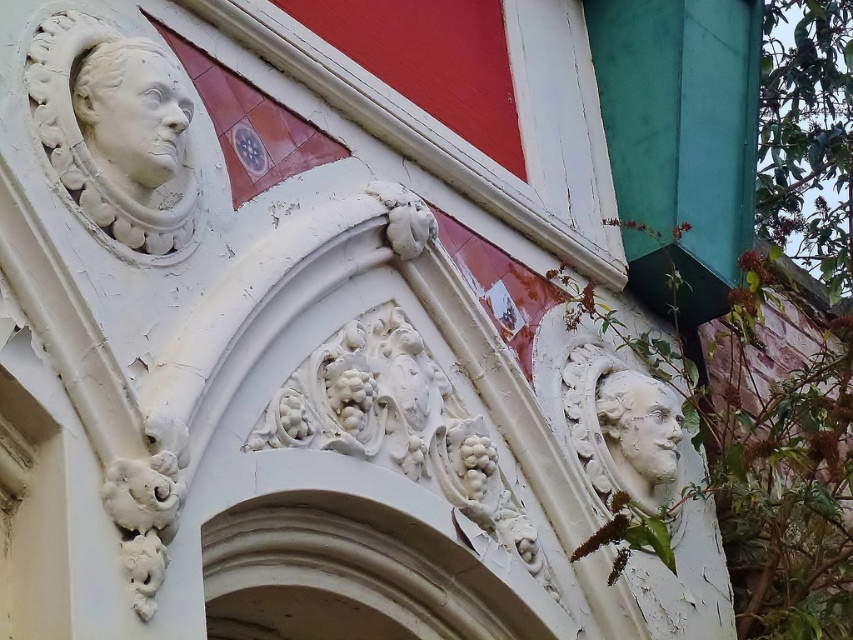
Question: Observing the image, what is the correct spatial positioning of white plaster face at upper left in reference to white stone face at lower right?

Choices:
 (A) left
 (B) right

Answer: (A)

Question: Can you confirm if white plaster face at upper left is positioned to the left of white stone face at lower right?

Choices:
 (A) yes
 (B) no

Answer: (A)

Question: Can you confirm if white plaster face at upper left is positioned above white stone face at lower right?

Choices:
 (A) no
 (B) yes

Answer: (B)

Question: Which object is farther from the camera taking this photo?

Choices:
 (A) white stone face at lower right
 (B) white plaster face at upper left

Answer: (A)

Question: Which point is farther to the camera?

Choices:
 (A) (647, 401)
 (B) (112, 134)

Answer: (A)